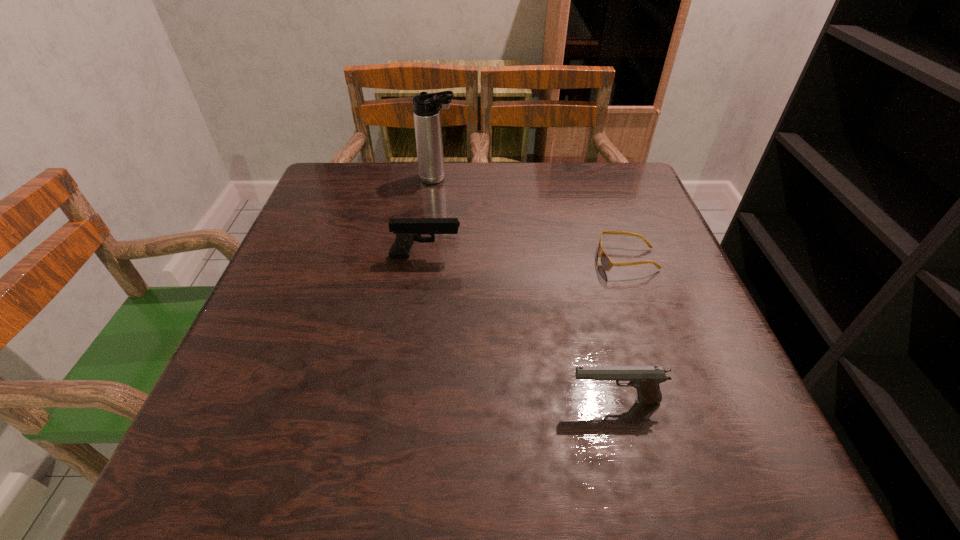
Where is `the tallest object`? This screenshot has width=960, height=540. the tallest object is located at coordinates pos(426,111).

Find the location of a particular element. This screenshot has width=960, height=540. the farthest object is located at coordinates (426, 111).

Where is `the farther pistol`? Image resolution: width=960 pixels, height=540 pixels. the farther pistol is located at coordinates (407, 230).

Image resolution: width=960 pixels, height=540 pixels. What are the coordinates of `the nearest object` in the screenshot? It's located at (646, 379).

At what (x,y) coordinates should I click in order to perform the action: click on the nearer pistol. Please return your answer as a coordinate pair (x, y). This screenshot has height=540, width=960. Looking at the image, I should click on (646, 379).

Locate an element on the screen. the shortest object is located at coordinates (606, 263).

Where is `vacant space located on the handle side of the tallest object`? The image size is (960, 540). vacant space located on the handle side of the tallest object is located at coordinates (578, 179).

The height and width of the screenshot is (540, 960). What are the coordinates of `free region located on the front-facing side of the left pistol` in the screenshot? It's located at coord(629,256).

The height and width of the screenshot is (540, 960). Find the location of `blank area located at the barrel of the right pistol`. blank area located at the barrel of the right pistol is located at coordinates (361, 401).

Locate an element on the screen. Image resolution: width=960 pixels, height=540 pixels. free point located at the barrel of the right pistol is located at coordinates (317, 401).